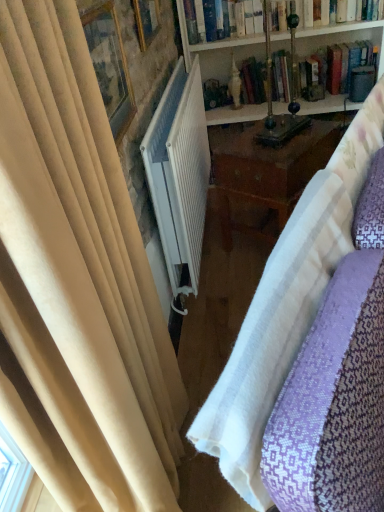
Question: From a real-world perspective, is white textured fabric at center positioned over wooden picture frame at upper center, the 2th picture frame from the front, based on gravity?

Choices:
 (A) yes
 (B) no

Answer: (B)

Question: Is white textured fabric at center positioned with its back to wooden picture frame at upper center, marked as the 1th picture frame in a back-to-front arrangement?

Choices:
 (A) yes
 (B) no

Answer: (B)

Question: Is white textured fabric at center to the right of wooden picture frame at upper center, the 2th picture frame from the front, from the viewer's perspective?

Choices:
 (A) yes
 (B) no

Answer: (A)

Question: Considering the relative sizes of white textured fabric at center and wooden picture frame at upper center, marked as the 1th picture frame in a back-to-front arrangement, in the image provided, is white textured fabric at center thinner than wooden picture frame at upper center, marked as the 1th picture frame in a back-to-front arrangement,?

Choices:
 (A) yes
 (B) no

Answer: (B)

Question: Can you confirm if white textured fabric at center is bigger than wooden picture frame at upper center, the 1th picture frame from the top?

Choices:
 (A) yes
 (B) no

Answer: (A)

Question: Does point (119, 56) appear closer or farther from the camera than point (261, 354)?

Choices:
 (A) closer
 (B) farther

Answer: (B)

Question: Considering the positions of matte gold picture frame at upper left, which is the second picture frame in top-to-bottom order, and white textured fabric at center in the image, is matte gold picture frame at upper left, which is the second picture frame in top-to-bottom order, bigger or smaller than white textured fabric at center?

Choices:
 (A) big
 (B) small

Answer: (B)

Question: From a real-world perspective, is matte gold picture frame at upper left, the 2th picture frame positioned from the back, physically located above or below white textured fabric at center?

Choices:
 (A) above
 (B) below

Answer: (A)

Question: Considering the positions of matte gold picture frame at upper left, the first picture frame positioned from the bottom, and white textured fabric at center in the image, is matte gold picture frame at upper left, the first picture frame positioned from the bottom, taller or shorter than white textured fabric at center?

Choices:
 (A) short
 (B) tall

Answer: (A)

Question: Considering the positions of point (251, 34) and point (109, 51), is point (251, 34) closer or farther from the camera than point (109, 51)?

Choices:
 (A) farther
 (B) closer

Answer: (A)

Question: From a real-world perspective, is hardcover book at upper center above or below matte gold picture frame at upper left, the 2th picture frame positioned from the back?

Choices:
 (A) below
 (B) above

Answer: (A)

Question: Looking at their shapes, would you say hardcover book at upper center is wider or thinner than matte gold picture frame at upper left, which is the second picture frame in top-to-bottom order?

Choices:
 (A) thin
 (B) wide

Answer: (B)

Question: Would you say hardcover book at upper center is to the left or to the right of matte gold picture frame at upper left, which is the first picture frame from front to back, in the picture?

Choices:
 (A) right
 (B) left

Answer: (A)

Question: From the image's perspective, is matte gold picture frame at upper left, the 2th picture frame positioned from the back, located above or below white wooden bookcase at upper center?

Choices:
 (A) below
 (B) above

Answer: (A)

Question: Based on their positions, is matte gold picture frame at upper left, which is the first picture frame from front to back, located to the left or right of white wooden bookcase at upper center?

Choices:
 (A) left
 (B) right

Answer: (A)